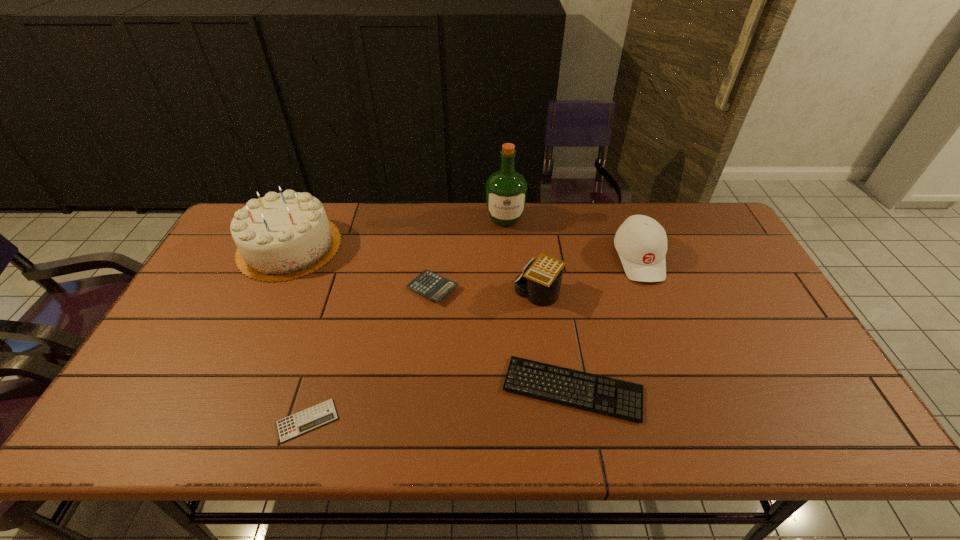
Where is `calculator located at the near edge`? calculator located at the near edge is located at coordinates (323, 413).

Locate an element on the screen. object present at the left edge is located at coordinates (282, 236).

Identify the location of object that is at the far left corner. This screenshot has width=960, height=540. (282, 236).

The image size is (960, 540). I want to click on vacant space at the far edge, so (608, 219).

The width and height of the screenshot is (960, 540). In the image, there is a desktop. Find the location of `vacant space at the left edge`. vacant space at the left edge is located at coordinates (192, 301).

This screenshot has height=540, width=960. In order to click on free space at the right edge in this screenshot , I will do `click(748, 307)`.

The image size is (960, 540). I want to click on vacant area that lies between the liquor and the sixth shortest object, so click(x=397, y=233).

The height and width of the screenshot is (540, 960). I want to click on free space between the baseball cap and the liquor, so click(x=572, y=239).

Image resolution: width=960 pixels, height=540 pixels. I want to click on vacant area that lies between the shortest object and the second calculator from right to left, so click(x=371, y=354).

Where is `free spot between the liquor and the baseball cap`? This screenshot has width=960, height=540. free spot between the liquor and the baseball cap is located at coordinates (572, 239).